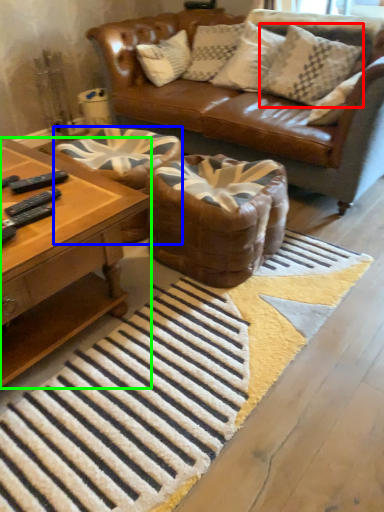
Question: Based on their relative distances, which object is nearer to pillow (highlighted by a red box)? Choose from swivel chair (highlighted by a blue box) and coffee table (highlighted by a green box).

Choices:
 (A) swivel chair
 (B) coffee table

Answer: (A)